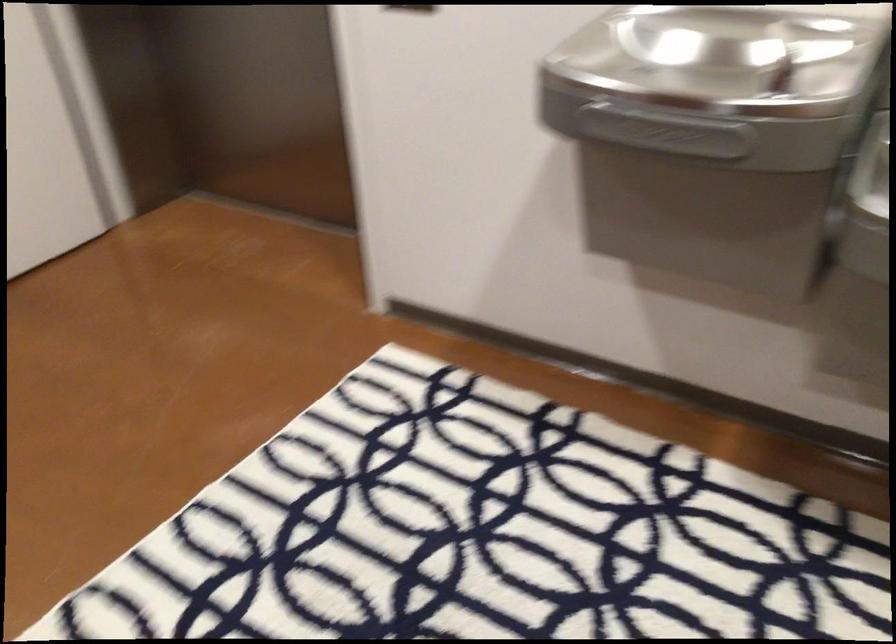
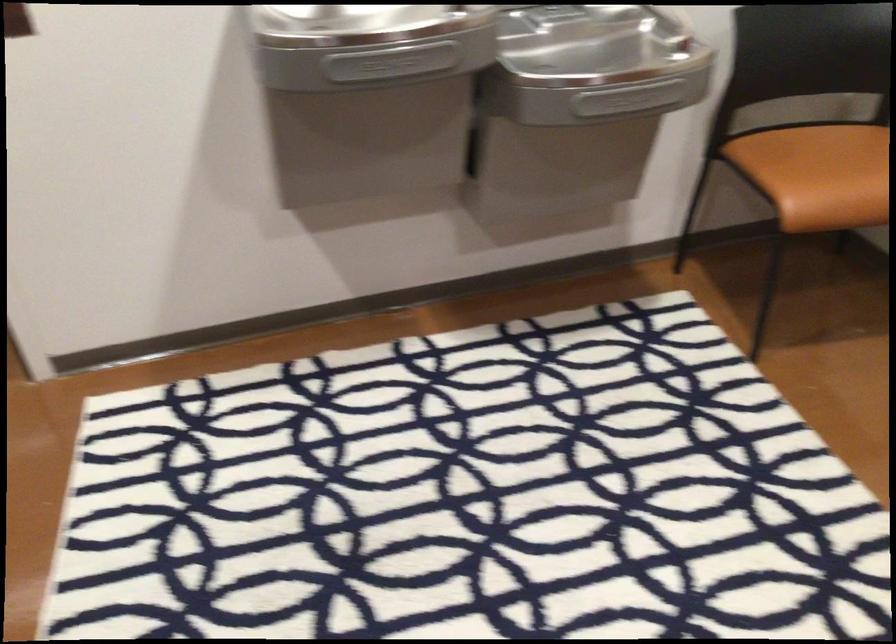
The point at (676, 129) is marked in the first image. Where is the corresponding point in the second image?

(391, 62)